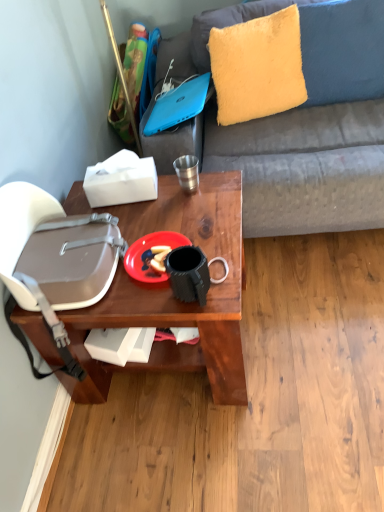
Question: Is plastic matte plate at center outside wooden table at center?

Choices:
 (A) no
 (B) yes

Answer: (A)

Question: Considering the relative positions of plastic matte plate at center and wooden table at center in the image provided, is plastic matte plate at center behind wooden table at center?

Choices:
 (A) no
 (B) yes

Answer: (B)

Question: Does plastic matte plate at center have a smaller size compared to wooden table at center?

Choices:
 (A) no
 (B) yes

Answer: (B)

Question: From a real-world perspective, is plastic matte plate at center over wooden table at center?

Choices:
 (A) yes
 (B) no

Answer: (A)

Question: Considering the relative sizes of plastic matte plate at center and wooden table at center in the image provided, is plastic matte plate at center bigger than wooden table at center?

Choices:
 (A) no
 (B) yes

Answer: (A)

Question: Is plastic matte plate at center at the right side of wooden table at center?

Choices:
 (A) no
 (B) yes

Answer: (B)

Question: From a real-world perspective, is wooden table at center physically above metallic silver cup at center?

Choices:
 (A) no
 (B) yes

Answer: (A)

Question: Considering the relative positions of wooden table at center and metallic silver cup at center in the image provided, is wooden table at center behind metallic silver cup at center?

Choices:
 (A) yes
 (B) no

Answer: (B)

Question: Does wooden table at center appear on the left side of metallic silver cup at center?

Choices:
 (A) no
 (B) yes

Answer: (B)

Question: Would you say wooden table at center contains metallic silver cup at center?

Choices:
 (A) yes
 (B) no

Answer: (B)

Question: Is wooden table at center shorter than metallic silver cup at center?

Choices:
 (A) no
 (B) yes

Answer: (A)

Question: From a real-world perspective, does wooden table at center sit lower than metallic silver cup at center?

Choices:
 (A) yes
 (B) no

Answer: (A)

Question: Can you confirm if metallic silver cup at center is thinner than blue matte laptop at upper center?

Choices:
 (A) no
 (B) yes

Answer: (B)